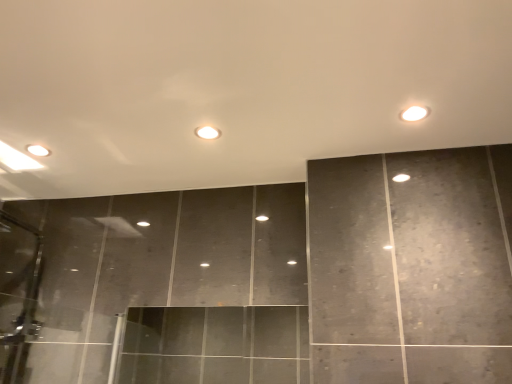
Question: Is white glossy light at center, marked as the 2th light in a right-to-left arrangement, taller or shorter than white glossy light at upper right, which is counted as the first light, starting from the front?

Choices:
 (A) tall
 (B) short

Answer: (B)

Question: From a real-world perspective, relative to white glossy light at upper right, which is the first light from right to left, is white glossy light at center, which is counted as the 1th light, starting from the left, vertically above or below?

Choices:
 (A) below
 (B) above

Answer: (B)

Question: Considering the relative positions of white glossy light at center, placed as the first light when sorted from back to front, and white glossy light at upper right, which is counted as the first light, starting from the front, in the image provided, is white glossy light at center, placed as the first light when sorted from back to front, to the left or to the right of white glossy light at upper right, which is counted as the first light, starting from the front,?

Choices:
 (A) left
 (B) right

Answer: (A)

Question: Considering their positions, is white glossy light at upper right, which is the first light from right to left, located in front of or behind white glossy light at center, which is counted as the 1th light, starting from the left?

Choices:
 (A) behind
 (B) front

Answer: (B)

Question: In terms of width, does white glossy light at upper right, which is counted as the first light, starting from the front, look wider or thinner when compared to white glossy light at center, placed as the first light when sorted from back to front?

Choices:
 (A) wide
 (B) thin

Answer: (B)

Question: From a real-world perspective, is white glossy light at upper right, which is the second light in back-to-front order, above or below white glossy light at center, marked as the 2th light in a right-to-left arrangement?

Choices:
 (A) below
 (B) above

Answer: (A)

Question: Is point (408, 115) positioned closer to the camera than point (202, 127)?

Choices:
 (A) closer
 (B) farther

Answer: (A)